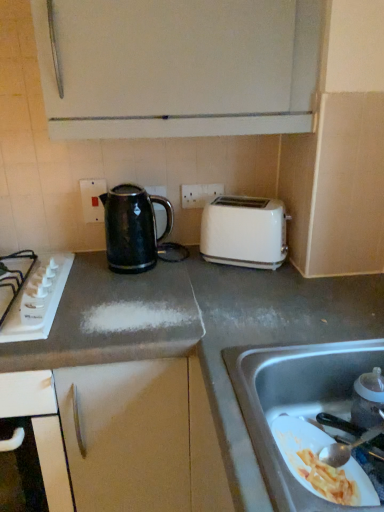
Question: From the image's perspective, would you say transparent plastic baby bottle at lower right is shown under stainless steel sink at lower right?

Choices:
 (A) no
 (B) yes

Answer: (A)

Question: Is transparent plastic baby bottle at lower right further to the viewer compared to stainless steel sink at lower right?

Choices:
 (A) yes
 (B) no

Answer: (A)

Question: Does transparent plastic baby bottle at lower right have a smaller size compared to stainless steel sink at lower right?

Choices:
 (A) no
 (B) yes

Answer: (B)

Question: From a real-world perspective, is transparent plastic baby bottle at lower right on stainless steel sink at lower right?

Choices:
 (A) yes
 (B) no

Answer: (A)

Question: Can you confirm if transparent plastic baby bottle at lower right is thinner than stainless steel sink at lower right?

Choices:
 (A) yes
 (B) no

Answer: (A)

Question: Considering their positions, is white plastic electric outlet at center, which is the 1th electric outlet from right to left, located in front of or behind matte plastic electrical outlet at upper center, the 2th electric outlet when ordered from right to left?

Choices:
 (A) front
 (B) behind

Answer: (B)

Question: Considering the positions of white plastic electric outlet at center, the 2th electric outlet positioned from the left, and matte plastic electrical outlet at upper center, the 2th electric outlet when ordered from right to left, in the image, is white plastic electric outlet at center, the 2th electric outlet positioned from the left, taller or shorter than matte plastic electrical outlet at upper center, the 2th electric outlet when ordered from right to left,?

Choices:
 (A) short
 (B) tall

Answer: (A)

Question: In terms of width, does white plastic electric outlet at center, the 2th electric outlet positioned from the left, look wider or thinner when compared to matte plastic electrical outlet at upper center, arranged as the 1th electric outlet when viewed from the left?

Choices:
 (A) thin
 (B) wide

Answer: (A)

Question: Based on their sizes in the image, would you say white plastic electric outlet at center, which is the 1th electric outlet from right to left, is bigger or smaller than matte plastic electrical outlet at upper center, the 2th electric outlet when ordered from right to left?

Choices:
 (A) small
 (B) big

Answer: (A)

Question: From the image's perspective, is matte plastic electrical outlet at upper center, the 2th electric outlet when ordered from right to left, above or below white plastic electric outlet at center, which is the 1th electric outlet from right to left?

Choices:
 (A) above
 (B) below

Answer: (B)

Question: Would you say matte plastic electrical outlet at upper center, the 2th electric outlet when ordered from right to left, is inside or outside white plastic electric outlet at center, the 2th electric outlet positioned from the left?

Choices:
 (A) outside
 (B) inside

Answer: (A)

Question: In the image, is matte plastic electrical outlet at upper center, the 2th electric outlet when ordered from right to left, positioned in front of or behind white plastic electric outlet at center, which is the 1th electric outlet from right to left?

Choices:
 (A) behind
 (B) front

Answer: (B)

Question: Is point (82, 195) positioned closer to the camera than point (208, 198)?

Choices:
 (A) closer
 (B) farther

Answer: (A)

Question: Would you say white glossy toaster at upper right is to the left or to the right of white plastic electric outlet at center, the 2th electric outlet positioned from the left, in the picture?

Choices:
 (A) right
 (B) left

Answer: (A)

Question: From a real-world perspective, is white glossy toaster at upper right physically located above or below white plastic electric outlet at center, the 2th electric outlet positioned from the left?

Choices:
 (A) above
 (B) below

Answer: (B)